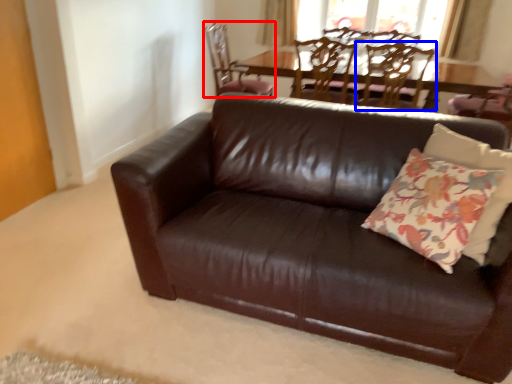
Question: Which point is further to the camera, chair (highlighted by a red box) or chair (highlighted by a blue box)?

Choices:
 (A) chair
 (B) chair

Answer: (A)